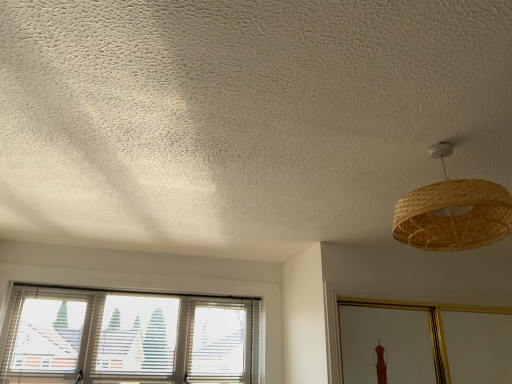
I want to click on bamboo woven lampshade at upper right, so click(453, 212).

Image resolution: width=512 pixels, height=384 pixels. Describe the element at coordinates (453, 212) in the screenshot. I see `bamboo woven lampshade at upper right` at that location.

The height and width of the screenshot is (384, 512). What do you see at coordinates (131, 336) in the screenshot?
I see `white textured blinds at lower left` at bounding box center [131, 336].

Identify the location of white textured blinds at lower left. (131, 336).

Measure the distance between point (245, 363) and camera.

Point (245, 363) and camera are 3.12 meters apart.

In order to face white textured blinds at lower left, should I rotate leftwards or rightwards?

Turn left by 15.480 degrees to look at white textured blinds at lower left.

You are a GUI agent. You are given a task and a screenshot of the screen. Output one action in this format:
    pyautogui.click(x=<x>, y=<y>)
    Task: Click on the bamboo woven lampshade at upper right
    This screenshot has height=384, width=512.
    Given the screenshot: What is the action you would take?
    pyautogui.click(x=453, y=212)

Considering the relative positions of white textured blinds at lower left and bamboo woven lampshade at upper right in the image provided, is white textured blinds at lower left to the left or to the right of bamboo woven lampshade at upper right?

Based on their positions, white textured blinds at lower left is located to the left of bamboo woven lampshade at upper right.

Relative to bamboo woven lampshade at upper right, is white textured blinds at lower left in front or behind?

In the image, white textured blinds at lower left appears behind bamboo woven lampshade at upper right.

Which is nearer, (182, 354) or (480, 182)?

Point (182, 354) is positioned farther from the camera compared to point (480, 182).

From the image's perspective, is white textured blinds at lower left on bamboo woven lampshade at upper right?

No.

From a real-world perspective, which object stands above the other?

From a 3D spatial view, bamboo woven lampshade at upper right is above.

Considering the sizes of white textured blinds at lower left and bamboo woven lampshade at upper right in the image, is white textured blinds at lower left wider or thinner than bamboo woven lampshade at upper right?

Considering their sizes, white textured blinds at lower left looks slimmer than bamboo woven lampshade at upper right.

Is white textured blinds at lower left shorter than bamboo woven lampshade at upper right?

Incorrect, the height of white textured blinds at lower left does not fall short of that of bamboo woven lampshade at upper right.

Is white textured blinds at lower left smaller than bamboo woven lampshade at upper right?

Actually, white textured blinds at lower left might be larger than bamboo woven lampshade at upper right.

Is bamboo woven lampshade at upper right completely or partially inside white textured blinds at lower left?

No, white textured blinds at lower left does not contain bamboo woven lampshade at upper right.

Is white textured blinds at lower left in contact with bamboo woven lampshade at upper right?

No, white textured blinds at lower left is not beside bamboo woven lampshade at upper right.

Is white textured blinds at lower left facing towards bamboo woven lampshade at upper right?

Yes, white textured blinds at lower left is oriented towards bamboo woven lampshade at upper right.

How distant is white textured blinds at lower left from bamboo woven lampshade at upper right?

2.11 meters.

Locate an element on the screen. lamp that is in front of the white textured blinds at lower left is located at coordinates (453, 212).

Which is more to the left, bamboo woven lampshade at upper right or white textured blinds at lower left?

white textured blinds at lower left.

In the image, is bamboo woven lampshade at upper right positioned in front of or behind white textured blinds at lower left?

bamboo woven lampshade at upper right is positioned closer to the viewer than white textured blinds at lower left.

Is point (477, 211) farther from viewer compared to point (253, 378)?

No, (477, 211) is in front of (253, 378).

From the image's perspective, is bamboo woven lampshade at upper right located beneath white textured blinds at lower left?

No.

From a real-world perspective, between bamboo woven lampshade at upper right and white textured blinds at lower left, who is vertically higher?

bamboo woven lampshade at upper right, from a real-world perspective.

Considering the relative sizes of bamboo woven lampshade at upper right and white textured blinds at lower left in the image provided, is bamboo woven lampshade at upper right wider than white textured blinds at lower left?

Yes, bamboo woven lampshade at upper right is wider than white textured blinds at lower left.

Between bamboo woven lampshade at upper right and white textured blinds at lower left, which one has more height?

With more height is white textured blinds at lower left.

Does bamboo woven lampshade at upper right have a larger size compared to white textured blinds at lower left?

Incorrect, bamboo woven lampshade at upper right is not larger than white textured blinds at lower left.

Is white textured blinds at lower left surrounded by bamboo woven lampshade at upper right?

That's incorrect, white textured blinds at lower left is not inside bamboo woven lampshade at upper right.

Are bamboo woven lampshade at upper right and white textured blinds at lower left located far from each other?

bamboo woven lampshade at upper right is positioned a significant distance from white textured blinds at lower left.

Could you tell me if bamboo woven lampshade at upper right is turned towards white textured blinds at lower left?

No, bamboo woven lampshade at upper right is not turned towards white textured blinds at lower left.

Can you tell me how much bamboo woven lampshade at upper right and white textured blinds at lower left differ in facing direction?

0.366 degrees.

Where is `lamp lying above the white textured blinds at lower left (from the image's perspective)`? This screenshot has height=384, width=512. lamp lying above the white textured blinds at lower left (from the image's perspective) is located at coordinates (453, 212).

The image size is (512, 384). Find the location of `window below the bamboo woven lampshade at upper right (from the image's perspective)`. window below the bamboo woven lampshade at upper right (from the image's perspective) is located at coordinates (131, 336).

Where is `window below the bamboo woven lampshade at upper right (from a real-world perspective)`? The image size is (512, 384). window below the bamboo woven lampshade at upper right (from a real-world perspective) is located at coordinates (131, 336).